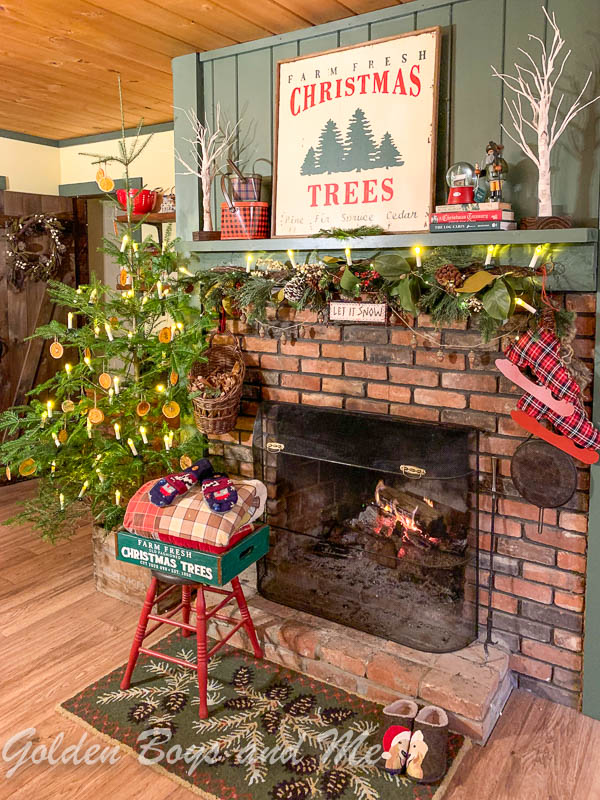
I want to click on white birch tree shelf ornaments, so click(x=545, y=106), click(x=206, y=190).